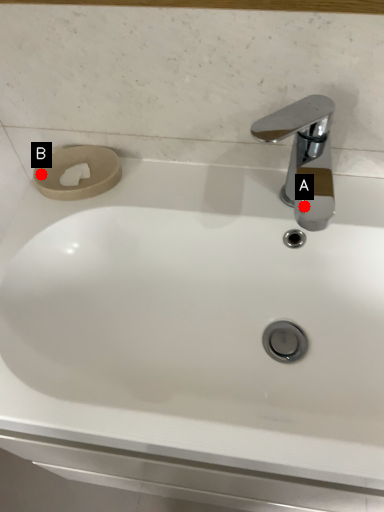
Question: Two points are circled on the image, labeled by A and B beside each circle. Which point appears closest to the camera in this image?

Choices:
 (A) A is closer
 (B) B is closer

Answer: (B)